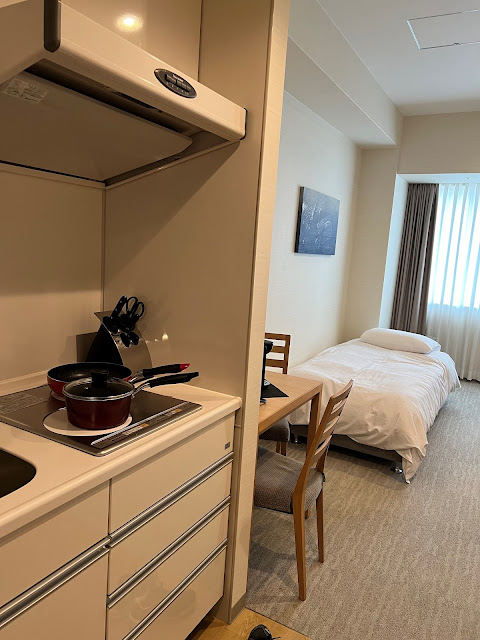
Locate an element on the screen. This screenshot has width=480, height=640. kitchen drawers is located at coordinates (147, 496), (160, 528), (171, 569), (183, 612), (28, 525), (68, 586).